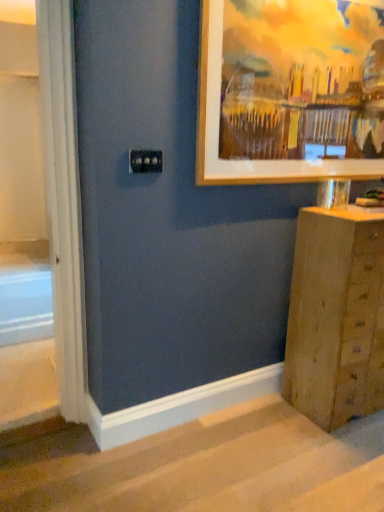
Image resolution: width=384 pixels, height=512 pixels. Describe the element at coordinates (280, 90) in the screenshot. I see `wooden frame at upper right` at that location.

Where is `carpeted stairs at lower center`? This screenshot has width=384, height=512. carpeted stairs at lower center is located at coordinates (204, 467).

In order to face carpeted stairs at lower center, should I rotate leftwards or rightwards?

A 8.046 degree turn to the right will do.

The width and height of the screenshot is (384, 512). In order to click on wooden frame at upper right in this screenshot , I will do `click(280, 90)`.

Is carpeted stairs at lower center oriented towards wooden frame at upper right?

No, carpeted stairs at lower center is not aimed at wooden frame at upper right.

Looking at this image, considering the relative sizes of carpeted stairs at lower center and wooden frame at upper right in the image provided, is carpeted stairs at lower center thinner than wooden frame at upper right?

No.

Consider the image. In the image, is carpeted stairs at lower center positioned in front of or behind wooden frame at upper right?

Clearly, carpeted stairs at lower center is in front of wooden frame at upper right.

Considering the positions of objects carpeted stairs at lower center and wooden frame at upper right in the image provided, who is more to the right, carpeted stairs at lower center or wooden frame at upper right?

Positioned to the right is wooden frame at upper right.

From the image's perspective, which is below, wooden chest of drawers at lower right or carpeted stairs at lower center?

carpeted stairs at lower center, from the image's perspective.

Does wooden chest of drawers at lower right contain carpeted stairs at lower center?

No, carpeted stairs at lower center is not surrounded by wooden chest of drawers at lower right.

Which object is further away from the camera, wooden chest of drawers at lower right or carpeted stairs at lower center?

wooden chest of drawers at lower right.

Is wooden chest of drawers at lower right at the right side of carpeted stairs at lower center?

Yes, wooden chest of drawers at lower right is to the right of carpeted stairs at lower center.

Is wooden frame at upper right to the left of wooden chest of drawers at lower right from the viewer's perspective?

Correct, you'll find wooden frame at upper right to the left of wooden chest of drawers at lower right.

Does wooden frame at upper right contain wooden chest of drawers at lower right?

That's incorrect, wooden chest of drawers at lower right is not inside wooden frame at upper right.

Is wooden frame at upper right positioned far away from wooden chest of drawers at lower right?

That's not correct — wooden frame at upper right is a little close to wooden chest of drawers at lower right.

Does wooden frame at upper right have a lesser height compared to wooden chest of drawers at lower right?

Correct, wooden frame at upper right is not as tall as wooden chest of drawers at lower right.

From a real-world perspective, which object rests below the other?

carpeted stairs at lower center is physically lower.

Choose the correct answer: Is carpeted stairs at lower center inside wooden chest of drawers at lower right or outside it?

carpeted stairs at lower center cannot be found inside wooden chest of drawers at lower right.

I want to click on stairwell on the left of the wooden chest of drawers at lower right, so click(204, 467).

Between carpeted stairs at lower center and wooden chest of drawers at lower right, which one is positioned in front?

carpeted stairs at lower center is more forward.

Considering the relative positions of wooden frame at upper right and carpeted stairs at lower center in the image provided, is wooden frame at upper right to the right of carpeted stairs at lower center from the viewer's perspective?

Correct, you'll find wooden frame at upper right to the right of carpeted stairs at lower center.

Is wooden frame at upper right far from carpeted stairs at lower center?

Absolutely, wooden frame at upper right is distant from carpeted stairs at lower center.

Consider the image. From their relative heights in the image, would you say wooden frame at upper right is taller or shorter than carpeted stairs at lower center?

In the image, wooden frame at upper right appears to be taller than carpeted stairs at lower center.

Looking at this image, from a real-world perspective, does wooden frame at upper right sit lower than carpeted stairs at lower center?

No, from a real-world perspective, wooden frame at upper right is not beneath carpeted stairs at lower center.

From the image's perspective, which one is positioned lower, wooden chest of drawers at lower right or wooden frame at upper right?

From the image's view, wooden chest of drawers at lower right is below.

Does wooden chest of drawers at lower right have a lesser height compared to wooden frame at upper right?

In fact, wooden chest of drawers at lower right may be taller than wooden frame at upper right.

From a real-world perspective, is wooden chest of drawers at lower right physically located above or below wooden frame at upper right?

In terms of real-world spatial position, wooden chest of drawers at lower right is below wooden frame at upper right.

Consider the image. Is wooden chest of drawers at lower right located outside wooden frame at upper right?

wooden chest of drawers at lower right lies outside wooden frame at upper right's area.

The height and width of the screenshot is (512, 384). Find the location of `picture frame on the right side of carpeted stairs at lower center`. picture frame on the right side of carpeted stairs at lower center is located at coordinates (280, 90).

Where is `chest of drawers behind the carpeted stairs at lower center`? The width and height of the screenshot is (384, 512). chest of drawers behind the carpeted stairs at lower center is located at coordinates (336, 316).

Based on their spatial positions, is wooden frame at upper right or wooden chest of drawers at lower right closer to carpeted stairs at lower center?

The object closer to carpeted stairs at lower center is wooden chest of drawers at lower right.

From the image, which object appears to be nearer to carpeted stairs at lower center, wooden chest of drawers at lower right or wooden frame at upper right?

Among the two, wooden chest of drawers at lower right is located nearer to carpeted stairs at lower center.

Considering their positions, is wooden frame at upper right positioned closer to wooden chest of drawers at lower right than carpeted stairs at lower center?

carpeted stairs at lower center is positioned closer to the anchor wooden chest of drawers at lower right.

Looking at the image, which one is located closer to wooden frame at upper right, carpeted stairs at lower center or wooden chest of drawers at lower right?

Among the two, wooden chest of drawers at lower right is located nearer to wooden frame at upper right.

Considering their positions, is carpeted stairs at lower center positioned further to wooden chest of drawers at lower right than wooden frame at upper right?

wooden frame at upper right.

In the scene shown: Estimate the real-world distances between objects in this image. Which object is further from wooden frame at upper right, wooden chest of drawers at lower right or carpeted stairs at lower center?

Based on the image, carpeted stairs at lower center appears to be further to wooden frame at upper right.

What are the coordinates of `chest of drawers between wooden frame at upper right and carpeted stairs at lower center in the up-down direction` in the screenshot? It's located at (336, 316).